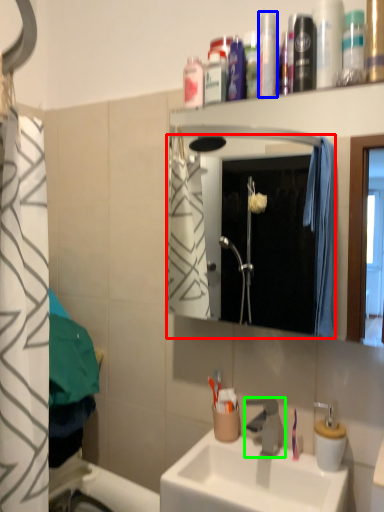
Question: Which object is the closest to the mirror (highlighted by a red box)? Choose among these: mouthwash (highlighted by a blue box) or tap (highlighted by a green box).

Choices:
 (A) mouthwash
 (B) tap

Answer: (B)